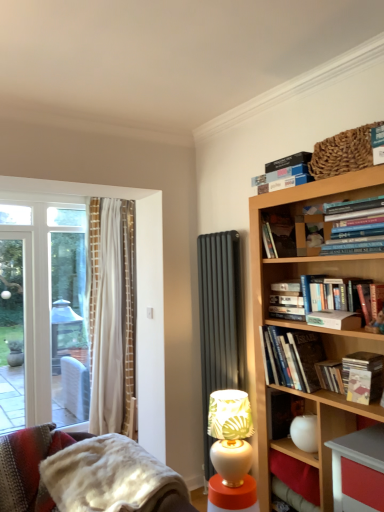
The width and height of the screenshot is (384, 512). I want to click on hardcover book at upper right, arranged as the fifth book when ordered from the bottom, so click(x=284, y=173).

Measure the distance between point (281, 168) and camera.

Point (281, 168) is 2.18 meters from camera.

Image resolution: width=384 pixels, height=512 pixels. What do you see at coordinates (282, 412) in the screenshot?
I see `hardcover book at center-right, which is the 5th paperback book from top to bottom` at bounding box center [282, 412].

In the scene shown: What is the approximate width of white glossy side table at lower center?

12.21 inches.

Describe the element at coordinates (232, 495) in the screenshot. The height and width of the screenshot is (512, 384). I see `white glossy side table at lower center` at that location.

The width and height of the screenshot is (384, 512). What do you see at coordinates (291, 357) in the screenshot?
I see `hardcover book at upper right, which is the 2th book in bottom-to-top order` at bounding box center [291, 357].

In order to click on hardcover book at upper right, acting as the 2th paperback book starting from the bottom in this screenshot , I will do `click(330, 375)`.

Where is `hardcover book at upper center, arranged as the third book when ordered from the bottom`? hardcover book at upper center, arranged as the third book when ordered from the bottom is located at coordinates (278, 236).

Does hardcover book at center-right, which is the 5th paperback book from top to bottom, have a greater width compared to hardcover book at upper right, marked as the 4th paperback book in a top-to-bottom arrangement?

Yes, hardcover book at center-right, which is the 5th paperback book from top to bottom, is wider than hardcover book at upper right, marked as the 4th paperback book in a top-to-bottom arrangement.

Based on the photo, from a real-world perspective, between hardcover book at center-right, which is the 5th paperback book from top to bottom, and hardcover book at upper right, marked as the 4th paperback book in a top-to-bottom arrangement, who is vertically higher?

In real-world perspective, hardcover book at upper right, marked as the 4th paperback book in a top-to-bottom arrangement, is above.

From the image's perspective, is hardcover book at center-right, which is the 5th paperback book from top to bottom, above hardcover book at upper right, acting as the 2th paperback book starting from the bottom?

No.

Between hardcover book at center-right, which is the 5th paperback book from top to bottom, and hardcover book at upper right, acting as the 2th paperback book starting from the bottom, which one is positioned behind?

hardcover book at center-right, which is the 5th paperback book from top to bottom, is more distant.

In the scene shown: Relative to hardcover book at upper right, marked as the 4th paperback book in a top-to-bottom arrangement, is hardcover book at upper right, which is the second paperback book from top to bottom, in front or behind?

hardcover book at upper right, which is the second paperback book from top to bottom, is positioned closer to the viewer than hardcover book at upper right, marked as the 4th paperback book in a top-to-bottom arrangement.

Is point (315, 316) positioned behind point (321, 387)?

No, it is in front of (321, 387).

From a real-world perspective, is hardcover book at upper right, marked as the fourth paperback book in a bottom-to-top arrangement, on hardcover book at upper right, marked as the 4th paperback book in a top-to-bottom arrangement?

Yes, from a real-world perspective, hardcover book at upper right, marked as the fourth paperback book in a bottom-to-top arrangement, is above hardcover book at upper right, marked as the 4th paperback book in a top-to-bottom arrangement.

What's the angular difference between hardcover book at upper right, which is the second paperback book from top to bottom, and hardcover book at upper right, acting as the 2th paperback book starting from the bottom,'s facing directions?

The angle between the facing direction of hardcover book at upper right, which is the second paperback book from top to bottom, and the facing direction of hardcover book at upper right, acting as the 2th paperback book starting from the bottom, is 3.47 degrees.

Does hardcover book at upper right, arranged as the fifth book when ordered from the bottom, turn towards hardcover book at upper right, the 1th paperback book positioned from the top?

No.

Does point (269, 182) come farther from viewer compared to point (283, 159)?

Yes, it is.

Where is `the 1st paperback book behind when counting from the hardcover book at upper right, the first book when ordered from top to bottom`? the 1st paperback book behind when counting from the hardcover book at upper right, the first book when ordered from top to bottom is located at coordinates (288, 161).

Which is in front, point (341, 384) or point (233, 399)?

The point (341, 384) is more forward.

Which is more to the right, hardcover book at upper right, marked as the 4th paperback book in a top-to-bottom arrangement, or white glossy table lamp at lower center?

Positioned to the right is hardcover book at upper right, marked as the 4th paperback book in a top-to-bottom arrangement.

Which object is thinner, hardcover book at upper right, marked as the 4th paperback book in a top-to-bottom arrangement, or white glossy table lamp at lower center?

hardcover book at upper right, marked as the 4th paperback book in a top-to-bottom arrangement, is thinner.

Does hardcover book at upper right, marked as the 4th paperback book in a top-to-bottom arrangement, turn towards white glossy table lamp at lower center?

No, hardcover book at upper right, marked as the 4th paperback book in a top-to-bottom arrangement, does not turn towards white glossy table lamp at lower center.

Is point (263, 187) closer or farther from the camera than point (360, 382)?

Point (263, 187) appears to be farther away from the viewer than point (360, 382).

From a real-world perspective, is hardcover book at upper right, arranged as the fifth book when ordered from the bottom, physically located above or below matte yellow paperback book at upper right, which appears as the 3th paperback book when viewed from the top?

Clearly, from a real-world perspective, hardcover book at upper right, arranged as the fifth book when ordered from the bottom, is above matte yellow paperback book at upper right, which appears as the 3th paperback book when viewed from the top.

Is hardcover book at upper right, arranged as the fifth book when ordered from the bottom, in front of matte yellow paperback book at upper right, arranged as the 3th paperback book when ordered from the bottom?

That is False.

Are hardcover book at upper right, arranged as the fifth book when ordered from the bottom, and matte yellow paperback book at upper right, arranged as the 3th paperback book when ordered from the bottom, making contact?

No, hardcover book at upper right, arranged as the fifth book when ordered from the bottom, is not touching matte yellow paperback book at upper right, arranged as the 3th paperback book when ordered from the bottom.

Would you consider hardcover book at upper right, placed as the 5th book when sorted from top to bottom, to be distant from hardcover book at upper right, which is the second book in top-to-bottom order?

No.

Who is bigger, hardcover book at upper right, which is counted as the first book, starting from the bottom, or hardcover book at upper right, acting as the fourth book starting from the bottom?

A: With larger size is hardcover book at upper right, acting as the fourth book starting from the bottom.

From the image's perspective, does hardcover book at upper right, placed as the 5th book when sorted from top to bottom, appear lower than hardcover book at upper right, which is the second book in top-to-bottom order?

Yes, from the image's perspective, hardcover book at upper right, placed as the 5th book when sorted from top to bottom, is below hardcover book at upper right, which is the second book in top-to-bottom order.

Is hardcover book at upper right, which is the second book in top-to-bottom order, at the back of hardcover book at upper right, placed as the 5th book when sorted from top to bottom?

No, hardcover book at upper right, placed as the 5th book when sorted from top to bottom, is not facing away from hardcover book at upper right, which is the second book in top-to-bottom order.

Is hardcover book at upper center, arranged as the third book when ordered from the bottom, inside or outside of hardcover book at upper right, which is the second book in top-to-bottom order?

hardcover book at upper center, arranged as the third book when ordered from the bottom, cannot be found inside hardcover book at upper right, which is the second book in top-to-bottom order.

How many degrees apart are the facing directions of hardcover book at upper center, arranged as the third book when ordered from the bottom, and hardcover book at upper right, acting as the fourth book starting from the bottom?

The angular difference between hardcover book at upper center, arranged as the third book when ordered from the bottom, and hardcover book at upper right, acting as the fourth book starting from the bottom, is 2.78 degrees.

Could you tell me if hardcover book at upper center, arranged as the third book when ordered from the bottom, is turned towards hardcover book at upper right, acting as the fourth book starting from the bottom?

No, hardcover book at upper center, arranged as the third book when ordered from the bottom, is not facing towards hardcover book at upper right, acting as the fourth book starting from the bottom.

Is point (287, 238) closer or farther from the camera than point (351, 228)?

Point (287, 238).

Which paperback book is the 2nd one when counting from the front of the hardcover book at center-right, which is the 5th paperback book from top to bottom? Please provide its 2D coordinates.

[(330, 375)]

Locate an element on the screen. the 2nd paperback book behind when counting from the hardcover book at upper right, which is the second paperback book from top to bottom is located at coordinates (330, 375).

Considering their positions, is hardcover book at upper right, which is the second paperback book from top to bottom, positioned closer to hardcover book at upper right, the 1th paperback book positioned from the top, than hardcover book at upper right, which is the fourth book in top-to-bottom order?

hardcover book at upper right, which is the second paperback book from top to bottom, lies closer to hardcover book at upper right, the 1th paperback book positioned from the top, than the other object.

Which object lies further to the anchor point hardcover book at upper right, arranged as the fifth book when ordered from the bottom, hardcover book at upper right, acting as the 2th paperback book starting from the bottom, or hardcover book at upper right, acting as the fourth book starting from the bottom?

hardcover book at upper right, acting as the 2th paperback book starting from the bottom, is further to hardcover book at upper right, arranged as the fifth book when ordered from the bottom.

Estimate the real-world distances between objects in this image. Which object is further from fuzzy woolen blanket at lower left, white glossy table lamp at lower center or hardcover book at center-right, which is the 5th paperback book from top to bottom?

hardcover book at center-right, which is the 5th paperback book from top to bottom, is further to fuzzy woolen blanket at lower left.

When comparing their distances from hardcover book at upper right, which is the 2th book in bottom-to-top order, does hardcover book at upper right, which is the 5th paperback book in bottom-to-top order, or hardcover book at upper center, the 3th book viewed from the top, seem closer?

hardcover book at upper center, the 3th book viewed from the top, is closer to hardcover book at upper right, which is the 2th book in bottom-to-top order.

Considering their positions, is hardcover book at upper right, which is the fourth book in top-to-bottom order, positioned closer to fuzzy woolen blanket at lower left than hardcover book at upper right, acting as the fourth book starting from the bottom?

hardcover book at upper right, which is the fourth book in top-to-bottom order, is positioned closer to the anchor fuzzy woolen blanket at lower left.

Consider the image. Estimate the real-world distances between objects in this image. Which object is further from hardcover book at upper right, the 1th paperback book positioned from the top, hardcover book at upper right, which is the second paperback book from top to bottom, or white glossy table lamp at lower center?

The object further to hardcover book at upper right, the 1th paperback book positioned from the top, is white glossy table lamp at lower center.

Based on their spatial positions, is matte yellow paperback book at upper right, which appears as the 3th paperback book when viewed from the top, or fuzzy woolen blanket at lower left closer to hardcover book at upper right, which is the fourth book in top-to-bottom order?

matte yellow paperback book at upper right, which appears as the 3th paperback book when viewed from the top.

Looking at this image, estimate the real-world distances between objects in this image. Which object is further from fuzzy woolen blanket at lower left, hardcover book at upper right, marked as the fourth paperback book in a bottom-to-top arrangement, or white glossy side table at lower center?

hardcover book at upper right, marked as the fourth paperback book in a bottom-to-top arrangement, is further to fuzzy woolen blanket at lower left.

Where is `side table between fuzzy woolen blanket at lower left and matte yellow paperback book at upper right, arranged as the 3th paperback book when ordered from the bottom, in the horizontal direction`? The image size is (384, 512). side table between fuzzy woolen blanket at lower left and matte yellow paperback book at upper right, arranged as the 3th paperback book when ordered from the bottom, in the horizontal direction is located at coordinates [232, 495].

The image size is (384, 512). Find the location of `paperback book that lies between hardcover book at upper right, acting as the fourth book starting from the bottom, and hardcover book at upper right, which is counted as the first book, starting from the bottom, from top to bottom`. paperback book that lies between hardcover book at upper right, acting as the fourth book starting from the bottom, and hardcover book at upper right, which is counted as the first book, starting from the bottom, from top to bottom is located at coordinates (334, 319).

Locate an element on the screen. table lamp between hardcover book at upper right, which is the 5th paperback book in bottom-to-top order, and fuzzy woolen blanket at lower left, in the vertical direction is located at coordinates (230, 434).

In order to click on paperback book between hardcover book at upper right, which is the second book in top-to-bottom order, and matte yellow paperback book at upper right, arranged as the 3th paperback book when ordered from the bottom, in the vertical direction in this screenshot , I will do (334, 319).